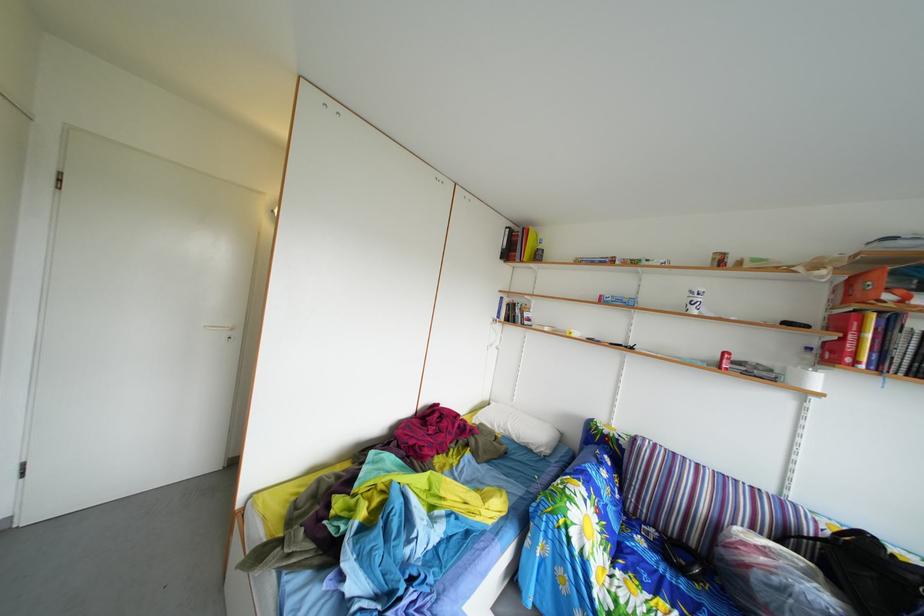
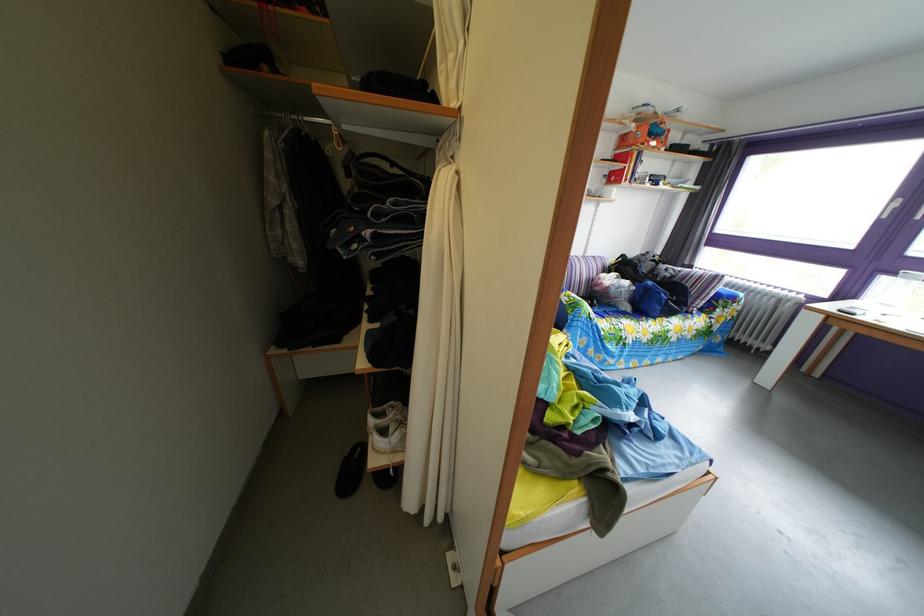
Locate, in the second image, the point that corresponds to [825,352] in the first image.

(618, 180)